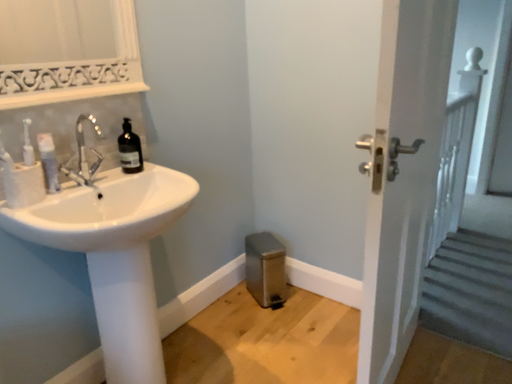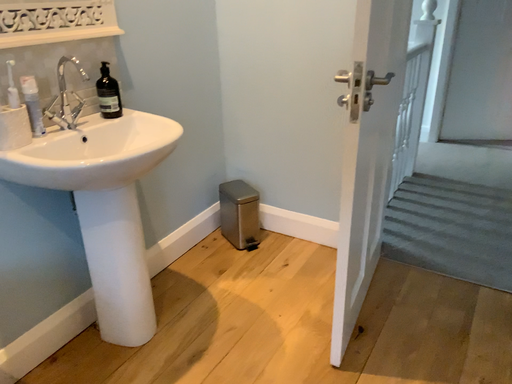
Question: Which way did the camera rotate in the video?

Choices:
 (A) rotated right
 (B) rotated left

Answer: (A)